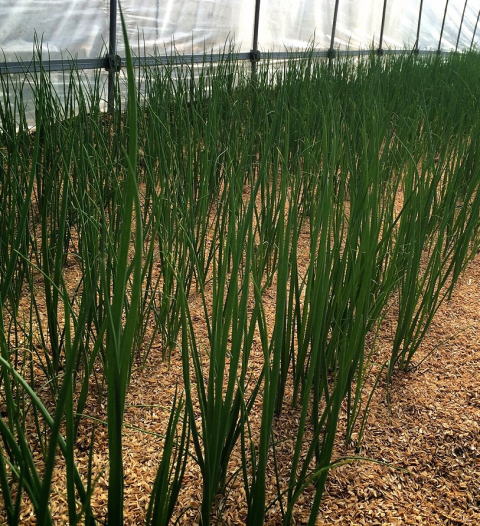
At what (x,y) coordinates should I click in order to perform the action: click on plants inside greenhouse. Please return your answer as a coordinate pair (x, y). The height and width of the screenshot is (526, 480). Looking at the image, I should click on (236, 323), (334, 124), (447, 90).